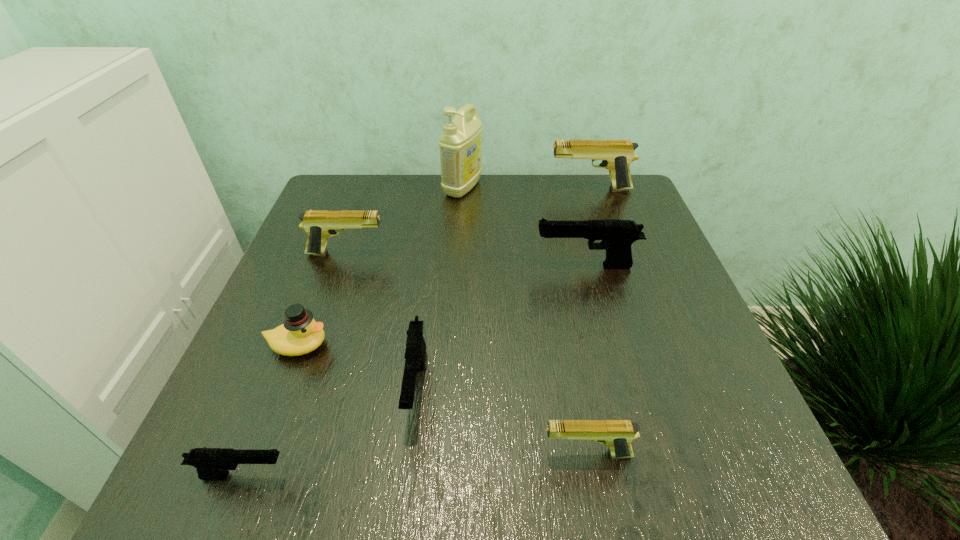
You are a GUI agent. You are given a task and a screenshot of the screen. Output one action in this format:
    pyautogui.click(x=<x>, y=<y>)
    Task: Click on the free space between the second smallest black pistol and the yellow duck
    Image resolution: width=960 pixels, height=540 pixels.
    Given the screenshot: What is the action you would take?
    pyautogui.click(x=357, y=366)

Locate an element on the screen. free space between the beige detergent and the second black pistol from left to right is located at coordinates (440, 287).

Locate an element on the screen. The image size is (960, 540). free space between the leftmost tan pistol and the beige detergent is located at coordinates (404, 221).

Locate an element on the screen. vacant space that's between the smallest tan pistol and the nearest object is located at coordinates (416, 465).

You are a GUI agent. You are given a task and a screenshot of the screen. Output one action in this format:
    pyautogui.click(x=<x>, y=<y>)
    Task: Click on the vacant region between the smallest black pistol and the second black pistol from right to left
    
    Given the screenshot: What is the action you would take?
    pyautogui.click(x=330, y=431)

At what (x,y) coordinates should I click in order to perform the action: click on unoccupied area between the farthest tan pistol and the detergent. Please return your answer as a coordinate pair (x, y). Image resolution: width=960 pixels, height=540 pixels. Looking at the image, I should click on (526, 188).

This screenshot has width=960, height=540. Identify the location of vacant region between the beige detergent and the farthest black pistol. (524, 227).

I want to click on empty space that is in between the fourth nearest pistol and the second black pistol from right to left, so coord(501,326).

This screenshot has width=960, height=540. I want to click on object that is the third closest to the biggest black pistol, so pos(415,351).

Locate an element on the screen. The width and height of the screenshot is (960, 540). the sixth closest object relative to the duck is located at coordinates (460, 144).